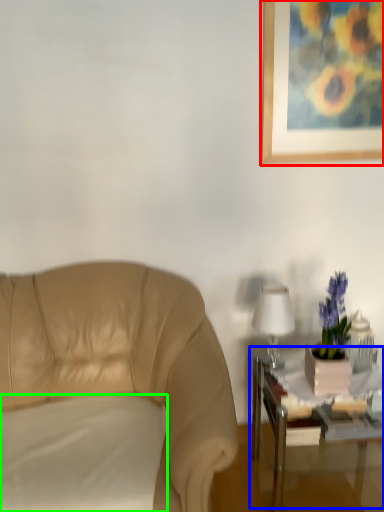
Question: Which is nearer to the picture frame (highlighted by a red box)? table (highlighted by a blue box) or pillow (highlighted by a green box).

Choices:
 (A) table
 (B) pillow

Answer: (A)